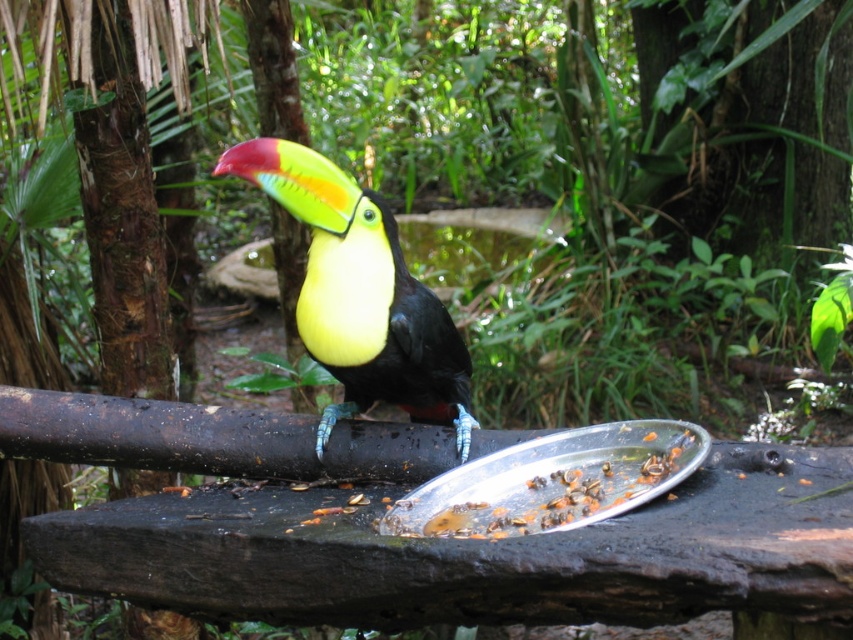
Looking at this image, you are a wildlife photographer standing 6 feet away from a dark wooden surface in a tropical forest. You want to take a closeup photo of the shiny multicolored toucan at center. Can you get within 6 feet of the bird without moving your position?

The shiny multicolored toucan at center is 5.95 feet away from the viewer, so yes, you can get within 6 feet of the bird without moving your position since the distance is slightly less than 6 feet.

You are a photographer trying to capture a closeup of the shiny multicolored toucan at center and the metallic silver tray at center. Since you want both objects to be in focus, which one should you adjust the camera focus on first?

The shiny multicolored toucan at center is bigger than the metallic silver tray at center, so you should focus on the shiny multicolored toucan at center first to ensure both are in focus.

You are a photographer aiming to capture the shiny multicolored toucan at center and the metallic silver tray at center in a single shot. Which object should you focus on first to ensure both are in focus?

You should focus on the shiny multicolored toucan at center first because it is closer to the viewer than the metallic silver tray at center, so focusing on the closer object will help keep both in focus.